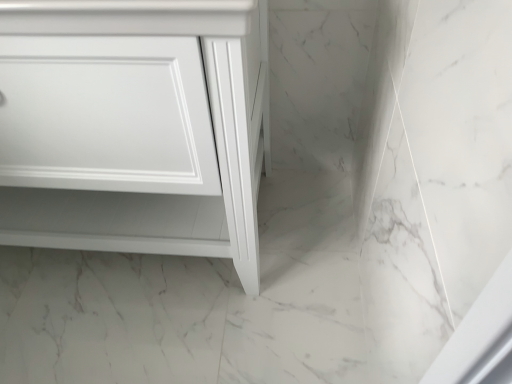
What is the approximate width of white glossy cabinet at lower left?

white glossy cabinet at lower left is 21.26 inches wide.

What do you see at coordinates (134, 126) in the screenshot? I see `white glossy cabinet at lower left` at bounding box center [134, 126].

Where is `white glossy cabinet at lower left`? The image size is (512, 384). white glossy cabinet at lower left is located at coordinates (134, 126).

The height and width of the screenshot is (384, 512). In order to click on white glossy cabinet at lower left in this screenshot , I will do `click(134, 126)`.